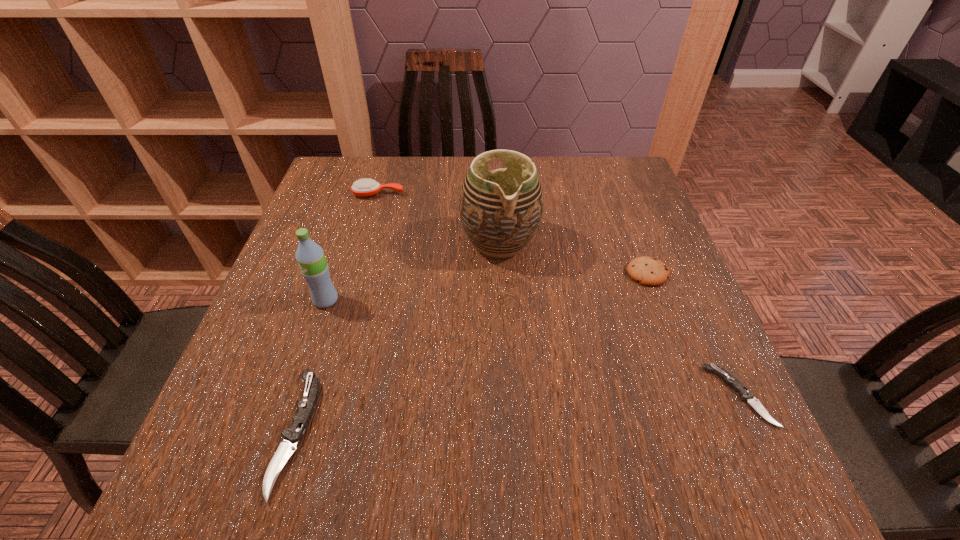
What are the coordinates of `free space located 0.340m on the left of the shorter pocketknife` in the screenshot? It's located at (518, 396).

Where is `free space located 0.070m on the left of the pottery`? The height and width of the screenshot is (540, 960). free space located 0.070m on the left of the pottery is located at coordinates (431, 242).

Identify the location of free space located 0.260m on the right of the hairbrush. (499, 194).

What are the coordinates of `free region located on the front of the water bottle` in the screenshot? It's located at (287, 418).

I want to click on free location located 0.100m on the front of the cookie, so click(666, 323).

The image size is (960, 540). What are the coordinates of `object that is positioned at the far edge` in the screenshot? It's located at (364, 187).

At what (x,y) coordinates should I click in order to perform the action: click on pocketknife that is at the left edge. Please return your answer as a coordinate pair (x, y). Looking at the image, I should click on (293, 435).

This screenshot has height=540, width=960. In order to click on hairbrush present at the left edge in this screenshot , I will do `click(364, 187)`.

Locate an element on the screen. water bottle positioned at the left edge is located at coordinates (310, 256).

At what (x,y) coordinates should I click in order to perform the action: click on pocketknife positioned at the right edge. Please return your answer as a coordinate pair (x, y). Looking at the image, I should click on (746, 395).